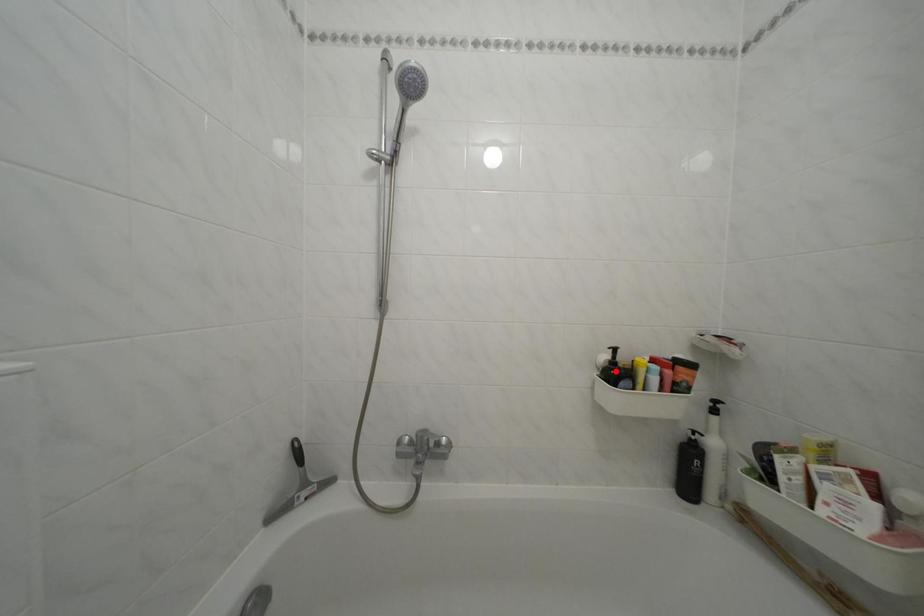
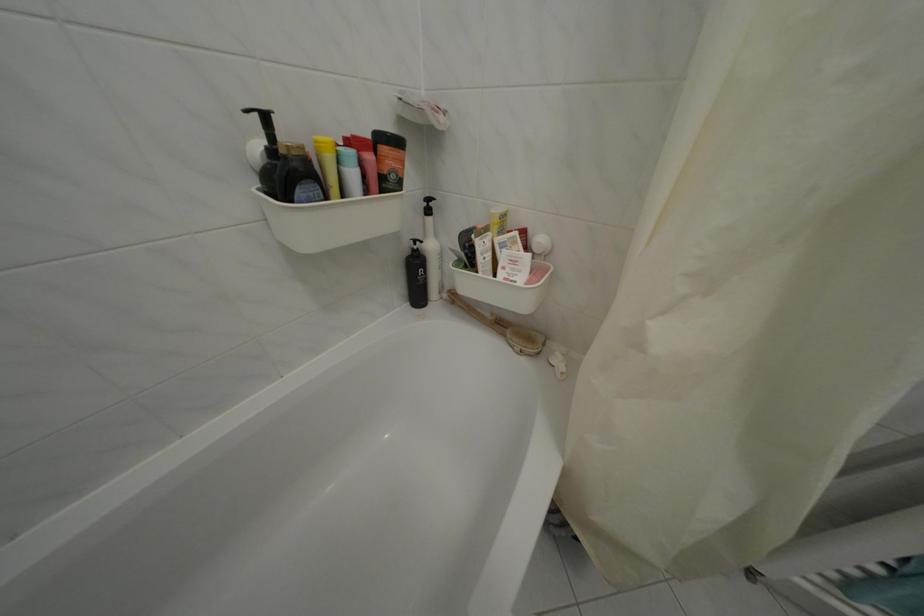
The point at the highlighted location is marked in the first image. Where is the corresponding point in the second image?

(274, 166)